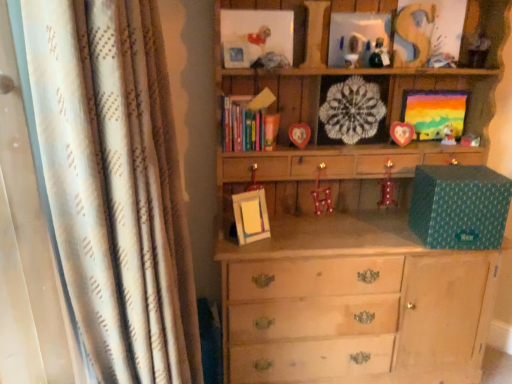
Question: Which direction should I rotate to face wooden heart-shaped frame at center, arranged as the second picture frame when viewed from the right, — up or down?

Choices:
 (A) up
 (B) down

Answer: (A)

Question: Would you consider metallic red candlestick at center-right, the first miniature positioned from the right, to be distant from wooden heart-shaped frame at center, marked as the 5th picture frame in a right-to-left arrangement?

Choices:
 (A) yes
 (B) no

Answer: (B)

Question: From a real-world perspective, is metallic red candlestick at center-right, the 2th miniature when ordered from left to right, positioned under wooden heart-shaped frame at center, which appears as the 4th picture frame when viewed from the left, based on gravity?

Choices:
 (A) no
 (B) yes

Answer: (B)

Question: Considering the relative sizes of metallic red candlestick at center-right, the first miniature positioned from the right, and wooden heart-shaped frame at center, marked as the 5th picture frame in a right-to-left arrangement, in the image provided, is metallic red candlestick at center-right, the first miniature positioned from the right, bigger than wooden heart-shaped frame at center, marked as the 5th picture frame in a right-to-left arrangement,?

Choices:
 (A) yes
 (B) no

Answer: (B)

Question: From a real-world perspective, is metallic red candlestick at center-right, the 2th miniature when ordered from left to right, on wooden heart-shaped frame at center, marked as the 5th picture frame in a right-to-left arrangement?

Choices:
 (A) yes
 (B) no

Answer: (B)

Question: From the image's perspective, would you say metallic red candlestick at center-right, the first miniature positioned from the right, is positioned over wooden heart-shaped frame at center, which appears as the 4th picture frame when viewed from the left?

Choices:
 (A) yes
 (B) no

Answer: (B)

Question: Does metallic red candlestick at center-right, the first miniature positioned from the right, have a smaller size compared to wooden heart-shaped frame at center, marked as the 5th picture frame in a right-to-left arrangement?

Choices:
 (A) yes
 (B) no

Answer: (A)

Question: Is glossy plastic toy at upper center, which ranks as the second toy in left-to-right order, thinner than matte white figurine at upper right, which is the 3th toy from right to left?

Choices:
 (A) yes
 (B) no

Answer: (B)

Question: Are glossy plastic toy at upper center, which is counted as the 4th toy, starting from the right, and matte white figurine at upper right, which is the fourth toy from top to bottom, far apart?

Choices:
 (A) yes
 (B) no

Answer: (B)

Question: From the image's perspective, is glossy plastic toy at upper center, positioned as the third toy in bottom-to-top order, below matte white figurine at upper right, which is counted as the 3th toy, starting from the left?

Choices:
 (A) no
 (B) yes

Answer: (A)

Question: From a real-world perspective, is glossy plastic toy at upper center, which is the third toy from top to bottom, physically above matte white figurine at upper right, acting as the 2th toy starting from the bottom?

Choices:
 (A) yes
 (B) no

Answer: (A)

Question: Considering the relative positions of glossy plastic toy at upper center, which is the third toy from top to bottom, and matte white figurine at upper right, which is the 3th toy from right to left, in the image provided, is glossy plastic toy at upper center, which is the third toy from top to bottom, to the left of matte white figurine at upper right, which is the 3th toy from right to left, from the viewer's perspective?

Choices:
 (A) no
 (B) yes

Answer: (B)

Question: Does glossy plastic toy at upper center, which is the third toy from top to bottom, have a larger size compared to matte white figurine at upper right, acting as the 2th toy starting from the bottom?

Choices:
 (A) no
 (B) yes

Answer: (B)

Question: Can you see wooden toy at upper right, arranged as the second toy when viewed from the right, touching matte plastic toy at center, placed as the first toy when sorted from right to left?

Choices:
 (A) no
 (B) yes

Answer: (A)